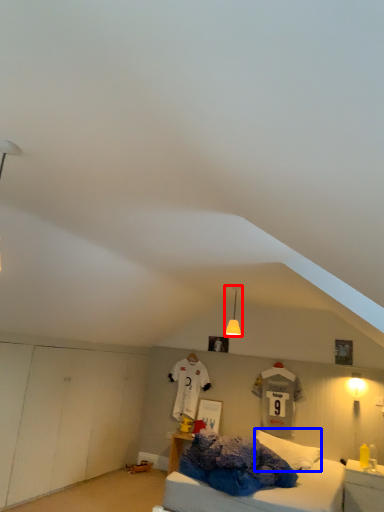
Question: Which object appears farthest to the camera in this image, light fixture (highlighted by a red box) or pillow (highlighted by a blue box)?

Choices:
 (A) light fixture
 (B) pillow

Answer: (B)